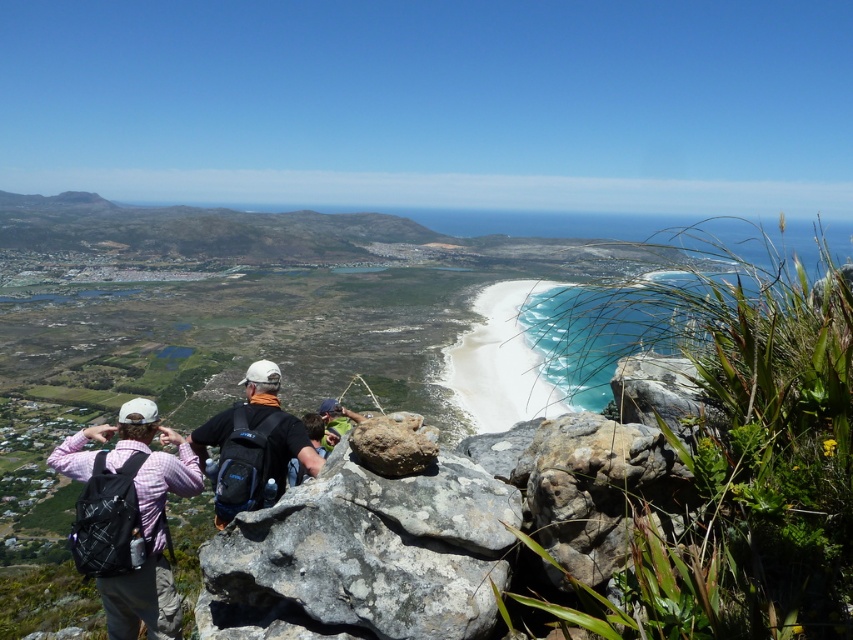
Question: Can you confirm if plaid fabric backpack at lower left is smaller than rusty rock at center?

Choices:
 (A) no
 (B) yes

Answer: (A)

Question: Based on their relative distances, which object is farther from the plaid fabric backpack at lower left?

Choices:
 (A) white sand beach at center
 (B) matte black backpack at center

Answer: (A)

Question: Can you confirm if gray rough rock at center is bigger than rusty rock at center?

Choices:
 (A) no
 (B) yes

Answer: (B)

Question: From the image, what is the correct spatial relationship of gray rough rock at center in relation to matte black backpack at center?

Choices:
 (A) below
 (B) above

Answer: (B)

Question: Estimate the real-world distances between objects in this image. Which object is closer to the rusty rock at center?

Choices:
 (A) gray rough rock at center
 (B) matte black backpack at center
 (C) plaid fabric backpack at lower left

Answer: (A)

Question: Among these objects, which one is farthest from the camera?

Choices:
 (A) rusty rock at center
 (B) white sand beach at center
 (C) plaid fabric backpack at lower left
 (D) gray rough rock at center

Answer: (B)